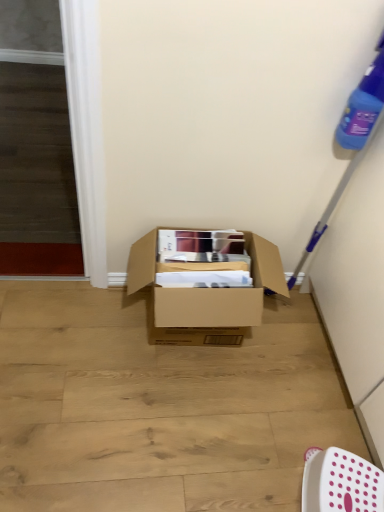
What do you see at coordinates (205, 296) in the screenshot?
I see `brown cardboard box at center` at bounding box center [205, 296].

Image resolution: width=384 pixels, height=512 pixels. What are the coordinates of `brown cardboard box at center` in the screenshot? It's located at (205, 296).

What is the approximate width of brown cardboard box at center?

It is 16.88 inches.

This screenshot has height=512, width=384. I want to click on white plastic chair at lower right, so click(341, 483).

This screenshot has height=512, width=384. What do you see at coordinates (341, 483) in the screenshot?
I see `white plastic chair at lower right` at bounding box center [341, 483].

In order to face white plastic chair at lower right, should I rotate leftwards or rightwards?

To align with it, rotate right about 19.905°.

Image resolution: width=384 pixels, height=512 pixels. Find the location of `brown cardboard box at center`. brown cardboard box at center is located at coordinates (205, 296).

Is white plastic chair at lower right to the left of brown cardboard box at center from the viewer's perspective?

Incorrect, white plastic chair at lower right is not on the left side of brown cardboard box at center.

Considering the relative positions of white plastic chair at lower right and brown cardboard box at center in the image provided, is white plastic chair at lower right behind brown cardboard box at center?

No, the depth of white plastic chair at lower right is less than that of brown cardboard box at center.

Considering the positions of points (334, 482) and (223, 335), is point (334, 482) farther from camera compared to point (223, 335)?

No, (334, 482) is in front of (223, 335).

Consider the image. From the image's perspective, is white plastic chair at lower right on brown cardboard box at center?

No, from the image's perspective, white plastic chair at lower right is not above brown cardboard box at center.

From a real-world perspective, is white plastic chair at lower right located beneath brown cardboard box at center?

Yes, from a real-world perspective, white plastic chair at lower right is under brown cardboard box at center.

In the scene shown: Considering the sizes of white plastic chair at lower right and brown cardboard box at center in the image, is white plastic chair at lower right wider or thinner than brown cardboard box at center?

In the image, white plastic chair at lower right appears to be more narrow than brown cardboard box at center.

In the scene shown: Considering the sizes of objects white plastic chair at lower right and brown cardboard box at center in the image provided, who is shorter, white plastic chair at lower right or brown cardboard box at center?

white plastic chair at lower right is shorter.

Which of these two, white plastic chair at lower right or brown cardboard box at center, is smaller?

white plastic chair at lower right is smaller.

Is white plastic chair at lower right situated inside brown cardboard box at center or outside?

white plastic chair at lower right is spatially situated outside brown cardboard box at center.

Is white plastic chair at lower right not near brown cardboard box at center?

That's not correct — white plastic chair at lower right is a little close to brown cardboard box at center.

Does white plastic chair at lower right turn towards brown cardboard box at center?

No, white plastic chair at lower right is not turned towards brown cardboard box at center.

Can you tell me how much white plastic chair at lower right and brown cardboard box at center differ in facing direction?

They differ by 107 degrees in their facing directions.

Where is `box above the white plastic chair at lower right (from a real-world perspective)`? The width and height of the screenshot is (384, 512). box above the white plastic chair at lower right (from a real-world perspective) is located at coordinates (205, 296).

Considering the positions of objects brown cardboard box at center and white plastic chair at lower right in the image provided, who is more to the left, brown cardboard box at center or white plastic chair at lower right?

Positioned to the left is brown cardboard box at center.

Relative to white plastic chair at lower right, is brown cardboard box at center in front or behind?

brown cardboard box at center is positioned farther from the viewer than white plastic chair at lower right.

Which is less distant, (x=276, y=253) or (x=320, y=451)?

Clearly, point (x=276, y=253) is more distant from the camera than point (x=320, y=451).

From the image's perspective, is brown cardboard box at center positioned above or below white plastic chair at lower right?

brown cardboard box at center is above white plastic chair at lower right.

From a real-world perspective, which is physically above, brown cardboard box at center or white plastic chair at lower right?

From a 3D spatial view, brown cardboard box at center is above.

Looking at their sizes, would you say brown cardboard box at center is wider or thinner than white plastic chair at lower right?

Considering their sizes, brown cardboard box at center looks broader than white plastic chair at lower right.

Between brown cardboard box at center and white plastic chair at lower right, which one has less height?

white plastic chair at lower right.

From the picture: Considering the sizes of brown cardboard box at center and white plastic chair at lower right in the image, is brown cardboard box at center bigger or smaller than white plastic chair at lower right?

Clearly, brown cardboard box at center is larger in size than white plastic chair at lower right.

Does brown cardboard box at center contain white plastic chair at lower right?

No, white plastic chair at lower right is located outside of brown cardboard box at center.

Is brown cardboard box at center next to white plastic chair at lower right?

No, brown cardboard box at center is not making contact with white plastic chair at lower right.

Is white plastic chair at lower right at the back of brown cardboard box at center?

No, brown cardboard box at center is not facing away from white plastic chair at lower right.

Measure the distance from brown cardboard box at center to white plastic chair at lower right.

24.35 inches.

You are a GUI agent. You are given a task and a screenshot of the screen. Output one action in this format:
    pyautogui.click(x=<x>, y=<y>)
    Task: Click on the chair in front of the brown cardboard box at center
    The height and width of the screenshot is (512, 384).
    Given the screenshot: What is the action you would take?
    pyautogui.click(x=341, y=483)

Identify the location of box above the white plastic chair at lower right (from the image's perspective). (205, 296).

Locate an element on the screen. This screenshot has width=384, height=512. box lying on the left of white plastic chair at lower right is located at coordinates (205, 296).